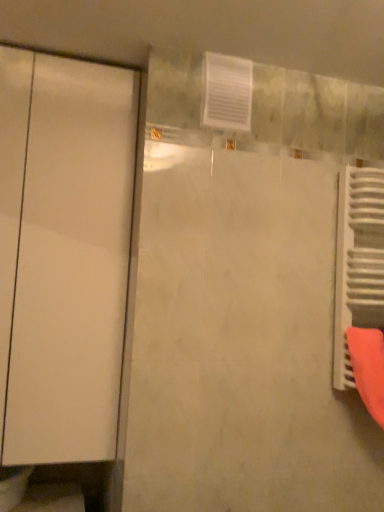
Image resolution: width=384 pixels, height=512 pixels. What do you see at coordinates (63, 254) in the screenshot?
I see `white glossy door at left` at bounding box center [63, 254].

This screenshot has width=384, height=512. I want to click on white glossy door at left, so click(63, 254).

Measure the distance between point (375, 324) and camera.

A distance of 1.42 meters exists between point (375, 324) and camera.

The image size is (384, 512). Describe the element at coordinates (358, 262) in the screenshot. I see `white metallic radiator at right` at that location.

Locate an element on the screen. Image resolution: width=384 pixels, height=512 pixels. white metallic radiator at right is located at coordinates (358, 262).

What is the approximate height of white metallic radiator at right?

The height of white metallic radiator at right is 31.23 inches.

Find the location of a particular element. The image size is (384, 512). white glossy door at left is located at coordinates (63, 254).

Which is more to the left, white metallic radiator at right or white glossy door at left?

From the viewer's perspective, white glossy door at left appears more on the left side.

Is white metallic radiator at right further to the viewer compared to white glossy door at left?

Yes, it is behind white glossy door at left.

Between point (341, 344) and point (73, 61), which one is positioned in front?

Positioned in front is point (73, 61).

From the image's perspective, who appears lower, white metallic radiator at right or white glossy door at left?

white metallic radiator at right appears lower in the image.

From a real-world perspective, who is located higher, white metallic radiator at right or white glossy door at left?

From a 3D spatial view, white glossy door at left is above.

Can you confirm if white metallic radiator at right is wider than white glossy door at left?

No.

Considering the sizes of objects white metallic radiator at right and white glossy door at left in the image provided, who is taller, white metallic radiator at right or white glossy door at left?

white glossy door at left.

Considering the relative sizes of white metallic radiator at right and white glossy door at left in the image provided, is white metallic radiator at right bigger than white glossy door at left?

Incorrect, white metallic radiator at right is not larger than white glossy door at left.

Choose the correct answer: Is white metallic radiator at right inside white glossy door at left or outside it?

white metallic radiator at right lies outside white glossy door at left.

Is white metallic radiator at right placed right next to white glossy door at left?

No, white metallic radiator at right is not touching white glossy door at left.

Is white metallic radiator at right looking in the opposite direction of white glossy door at left?

No, white metallic radiator at right is not facing away from white glossy door at left.

How distant is white metallic radiator at right from white glossy door at left?

white metallic radiator at right is 89.68 centimeters away from white glossy door at left.

Identify the location of door located above the white metallic radiator at right (from the image's perspective). (63, 254).

Considering the positions of objects white glossy door at left and white metallic radiator at right in the image provided, who is more to the right, white glossy door at left or white metallic radiator at right?

white metallic radiator at right.

Is the position of white glossy door at left more distant than that of white metallic radiator at right?

No.

Does point (75, 288) come farther from viewer compared to point (372, 197)?

That is False.

From the image's perspective, does white glossy door at left appear higher than white metallic radiator at right?

Indeed, from the image's perspective, white glossy door at left is shown above white metallic radiator at right.

From a real-world perspective, is white glossy door at left located higher than white metallic radiator at right?

Yes.

Is white glossy door at left wider than white metallic radiator at right?

Yes.

Can you confirm if white glossy door at left is taller than white metallic radiator at right?

Yes.

Considering the relative sizes of white glossy door at left and white metallic radiator at right in the image provided, is white glossy door at left smaller than white metallic radiator at right?

Incorrect, white glossy door at left is not smaller in size than white metallic radiator at right.

Would you say white glossy door at left contains white metallic radiator at right?

No.

In the scene shown: Does white glossy door at left touch white metallic radiator at right?

No, white glossy door at left is not next to white metallic radiator at right.

Could you tell me if white glossy door at left is turned towards white metallic radiator at right?

No.

Can you tell me how much white glossy door at left and white metallic radiator at right differ in facing direction?

The angular difference between white glossy door at left and white metallic radiator at right is 0.113 degrees.

This screenshot has height=512, width=384. I want to click on door above the white metallic radiator at right (from a real-world perspective), so click(x=63, y=254).

Where is `radiator on the right of white glossy door at left`? radiator on the right of white glossy door at left is located at coordinates (358, 262).

Image resolution: width=384 pixels, height=512 pixels. Identify the location of radiator that is under the white glossy door at left (from a real-world perspective). (358, 262).